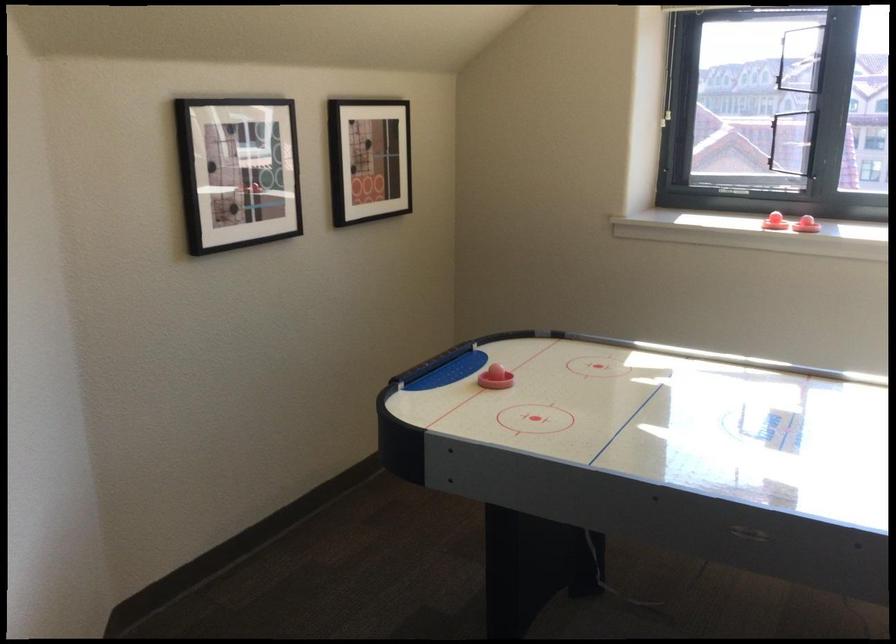
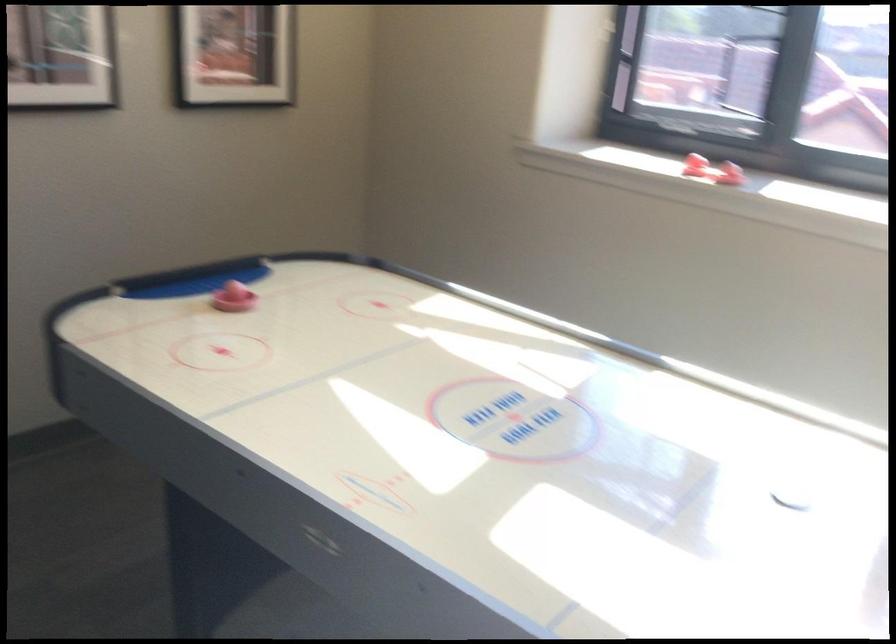
Question: The images are taken continuously from a first-person perspective. In which direction is your viewpoint rotating?

Choices:
 (A) Left
 (B) Right
 (C) Up
 (D) Down

Answer: (D)